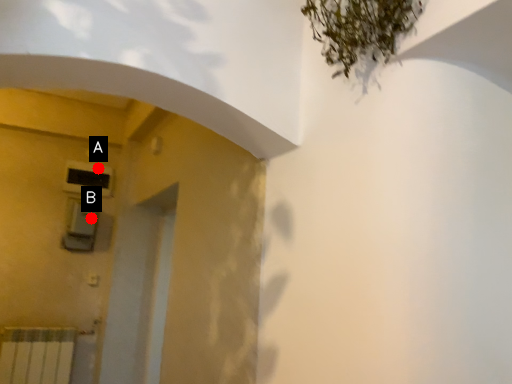
Question: Two points are circled on the image, labeled by A and B beside each circle. Which point is closer to the camera?

Choices:
 (A) A is closer
 (B) B is closer

Answer: (B)